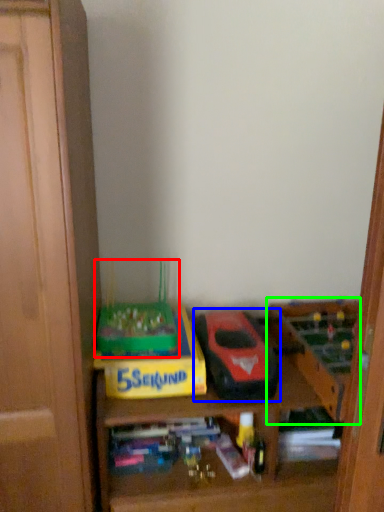
Question: Which is nearer to the toy (highlighted by a red box)? model car (highlighted by a blue box) or toy (highlighted by a green box).

Choices:
 (A) model car
 (B) toy

Answer: (A)